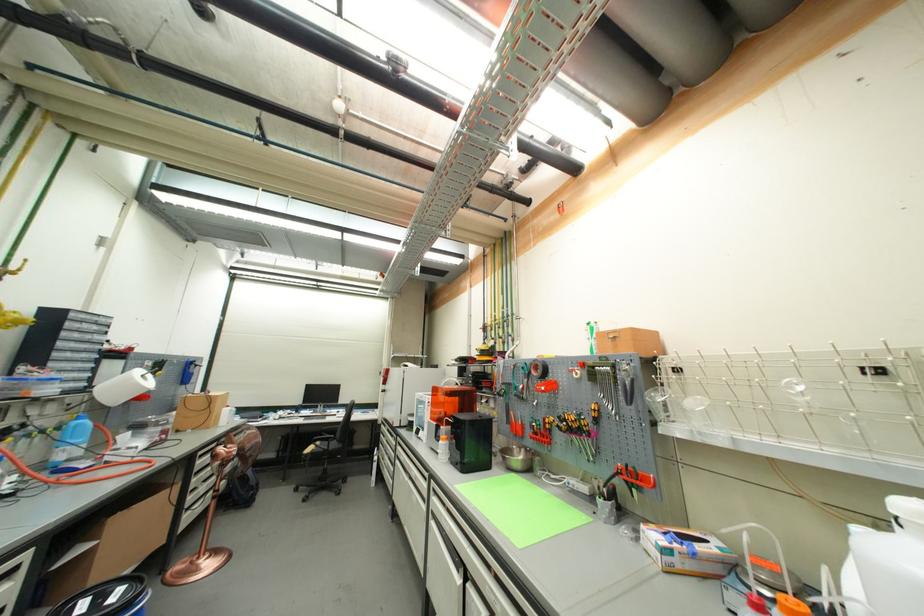
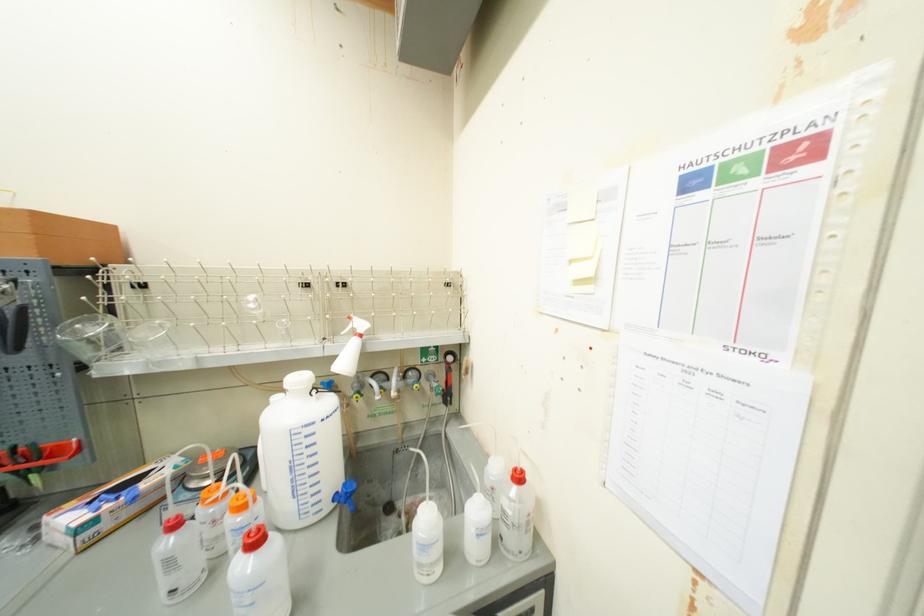
Locate, in the second image, the point that corresponds to point 629,468 in the first image.

(13, 453)